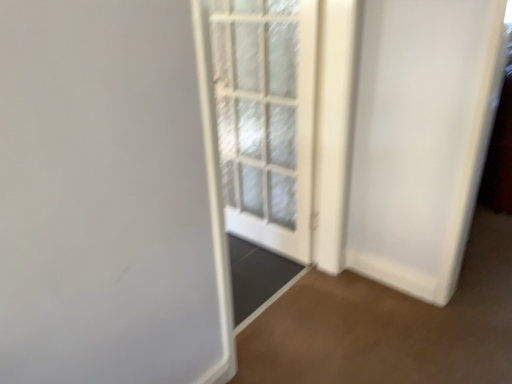
What do you see at coordinates (264, 117) in the screenshot? I see `white glass door at center` at bounding box center [264, 117].

The height and width of the screenshot is (384, 512). Identify the location of white glass door at center. (x=264, y=117).

Locate an element on the screen. The width and height of the screenshot is (512, 384). white glass door at center is located at coordinates (264, 117).